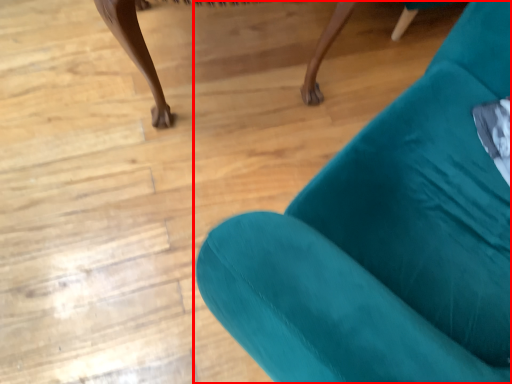
Question: In this image, where is chair (annotated by the red box) located relative to furniture?

Choices:
 (A) right
 (B) left

Answer: (A)